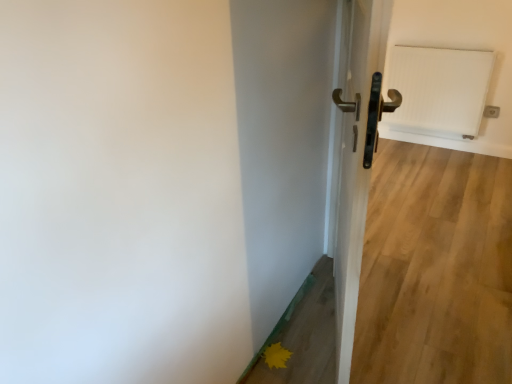
Locate an element on the screen. The width and height of the screenshot is (512, 384). metallic gold door handle at center is located at coordinates (354, 155).

Identify the location of white textured radiator at upper right. point(439,90).

Can you tell me how much yellow matte flower at lower right and white textured radiator at upper right differ in facing direction?

89.9 degrees separate the facing orientations of yellow matte flower at lower right and white textured radiator at upper right.

Is yellow matte flower at lower right turned away from white textured radiator at upper right?

No, white textured radiator at upper right is not at the back of yellow matte flower at lower right.

Where is `flower that appears on the left of white textured radiator at upper right`? The image size is (512, 384). flower that appears on the left of white textured radiator at upper right is located at coordinates (276, 355).

Looking at this image, from a real-world perspective, which object stands above the other?

white textured radiator at upper right.

Looking at this image, from a real-world perspective, is white textured radiator at upper right positioned above or below metallic gold door handle at center?

white textured radiator at upper right is situated lower than metallic gold door handle at center in the real world.

Is white textured radiator at upper right positioned with its back to metallic gold door handle at center?

No.

Is white textured radiator at upper right beside metallic gold door handle at center?

They are not placed beside each other.

Which object is positioned more to the right, metallic gold door handle at center or white textured radiator at upper right?

From the viewer's perspective, white textured radiator at upper right appears more on the right side.

Between point (380, 63) and point (450, 66), which one is positioned behind?

Positioned behind is point (450, 66).

Is white textured radiator at upper right inside metallic gold door handle at center?

Result: No, white textured radiator at upper right is not inside metallic gold door handle at center.

From a real-world perspective, is metallic gold door handle at center positioned above or below white textured radiator at upper right?

In terms of real-world spatial position, metallic gold door handle at center is above white textured radiator at upper right.

From the image's perspective, is yellow matte flower at lower right above or below metallic gold door handle at center?

Clearly, from the image's perspective, yellow matte flower at lower right is below metallic gold door handle at center.

Considering the positions of objects yellow matte flower at lower right and metallic gold door handle at center in the image provided, who is more to the right, yellow matte flower at lower right or metallic gold door handle at center?

From the viewer's perspective, metallic gold door handle at center appears more on the right side.

Is yellow matte flower at lower right oriented away from metallic gold door handle at center?

yellow matte flower at lower right is not turned away from metallic gold door handle at center.

From the picture: Considering the sizes of objects yellow matte flower at lower right and metallic gold door handle at center in the image provided, who is thinner, yellow matte flower at lower right or metallic gold door handle at center?

With smaller width is yellow matte flower at lower right.

Consider the image. From the image's perspective, is white textured radiator at upper right on top of yellow matte flower at lower right?

Indeed, from the image's perspective, white textured radiator at upper right is shown above yellow matte flower at lower right.

Is white textured radiator at upper right shorter than yellow matte flower at lower right?

Incorrect, the height of white textured radiator at upper right does not fall short of that of yellow matte flower at lower right.

Is white textured radiator at upper right wider than yellow matte flower at lower right?

No, white textured radiator at upper right is not wider than yellow matte flower at lower right.

Is white textured radiator at upper right not within yellow matte flower at lower right?

Yes, white textured radiator at upper right is outside of yellow matte flower at lower right.

Is metallic gold door handle at center facing away from yellow matte flower at lower right?

That's right, metallic gold door handle at center is facing away from yellow matte flower at lower right.

From a real-world perspective, is metallic gold door handle at center above or below yellow matte flower at lower right?

metallic gold door handle at center is situated higher than yellow matte flower at lower right in the real world.

Is point (341, 91) closer to camera compared to point (271, 346)?

That is True.

This screenshot has width=512, height=384. Identify the location of flower that is on the left side of white textured radiator at upper right. (276, 355).

Where is `door that appears below the white textured radiator at upper right (from the image's perspective)`? The image size is (512, 384). door that appears below the white textured radiator at upper right (from the image's perspective) is located at coordinates (354, 155).

Which object lies further to the anchor point yellow matte flower at lower right, metallic gold door handle at center or white textured radiator at upper right?

white textured radiator at upper right.

From the image, which object appears to be nearer to white textured radiator at upper right, yellow matte flower at lower right or metallic gold door handle at center?

metallic gold door handle at center lies closer to white textured radiator at upper right than the other object.

When comparing their distances from white textured radiator at upper right, does metallic gold door handle at center or yellow matte flower at lower right seem closer?

Among the two, metallic gold door handle at center is located nearer to white textured radiator at upper right.

Based on their spatial positions, is white textured radiator at upper right or metallic gold door handle at center further from yellow matte flower at lower right?

The object further to yellow matte flower at lower right is white textured radiator at upper right.

In the scene shown: Based on their spatial positions, is white textured radiator at upper right or yellow matte flower at lower right further from metallic gold door handle at center?

The object further to metallic gold door handle at center is white textured radiator at upper right.

Based on their spatial positions, is yellow matte flower at lower right or white textured radiator at upper right closer to metallic gold door handle at center?

Based on the image, yellow matte flower at lower right appears to be nearer to metallic gold door handle at center.

Locate an element on the screen. Image resolution: width=512 pixels, height=384 pixels. flower between metallic gold door handle at center and white textured radiator at upper right in the front-back direction is located at coordinates (276, 355).